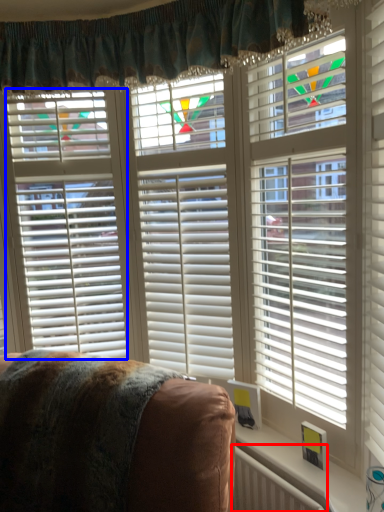
Question: Which point is closer to the camera, radiator (highlighted by a red box) or blind (highlighted by a blue box)?

Choices:
 (A) radiator
 (B) blind

Answer: (A)